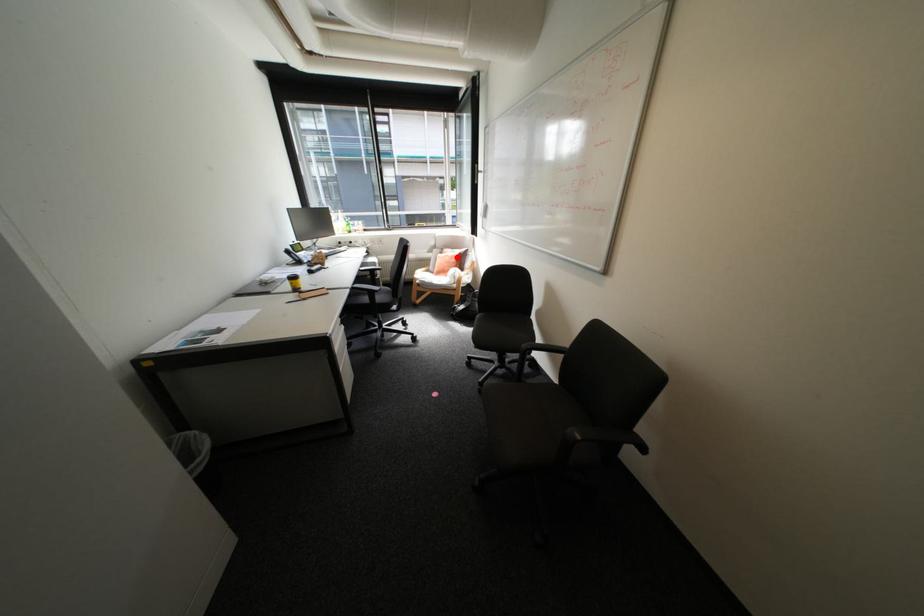
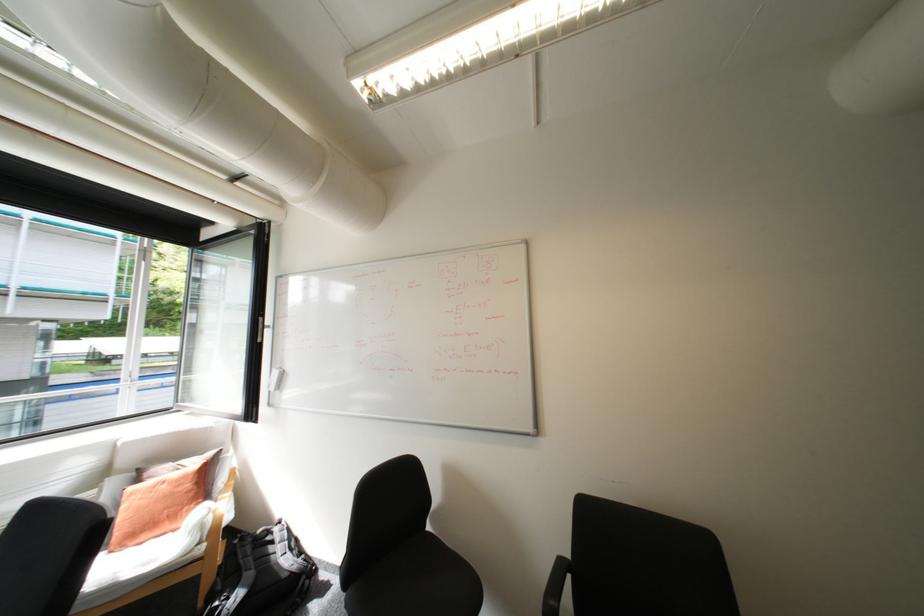
Question: I am providing you with two images of the same scene from different viewpoints. A red point is shown in image1. For the corresponding object point in image2, is it positioned nearer or farther from the camera?

Choices:
 (A) Nearer
 (B) Farther

Answer: (B)